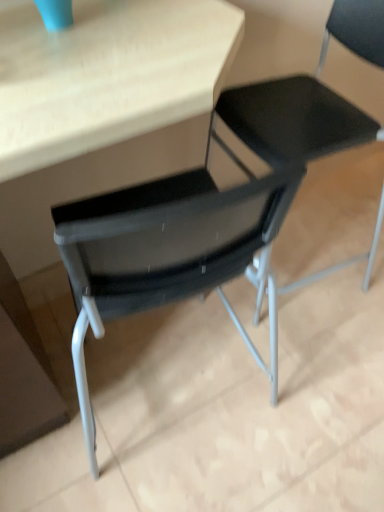
Identify the location of vacant area that lies to the right of matte wood table at center. (321, 397).